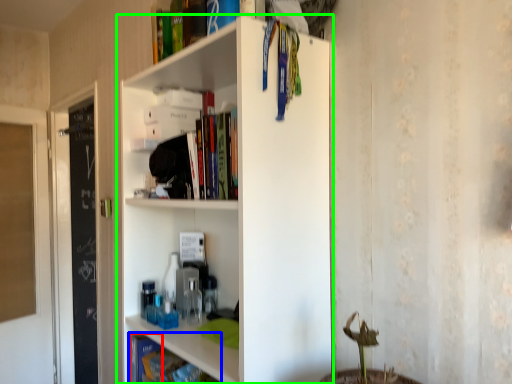
Question: Which object is positioned closest to book (highlighted by a red box)? Select from book (highlighted by a blue box) and shelf (highlighted by a green box).

Choices:
 (A) book
 (B) shelf

Answer: (A)